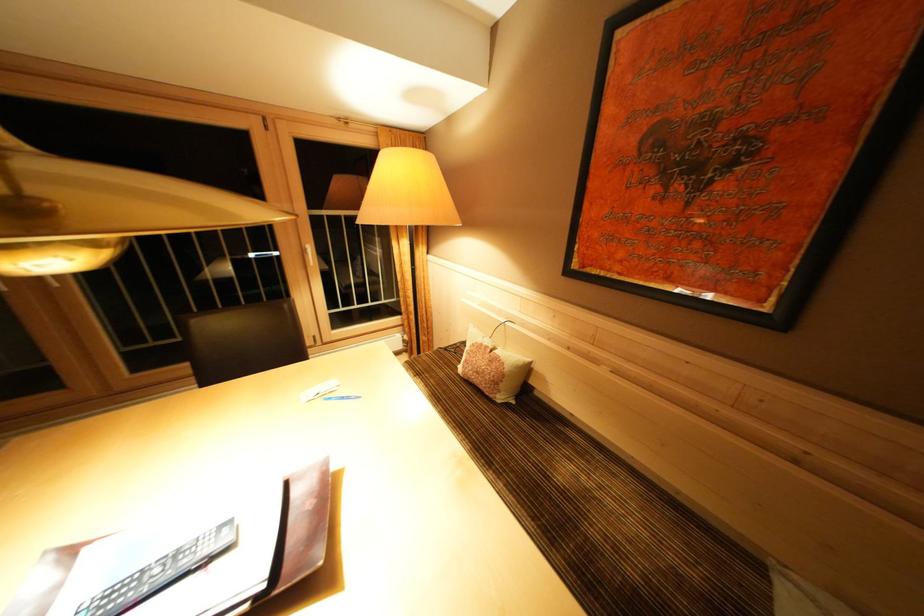
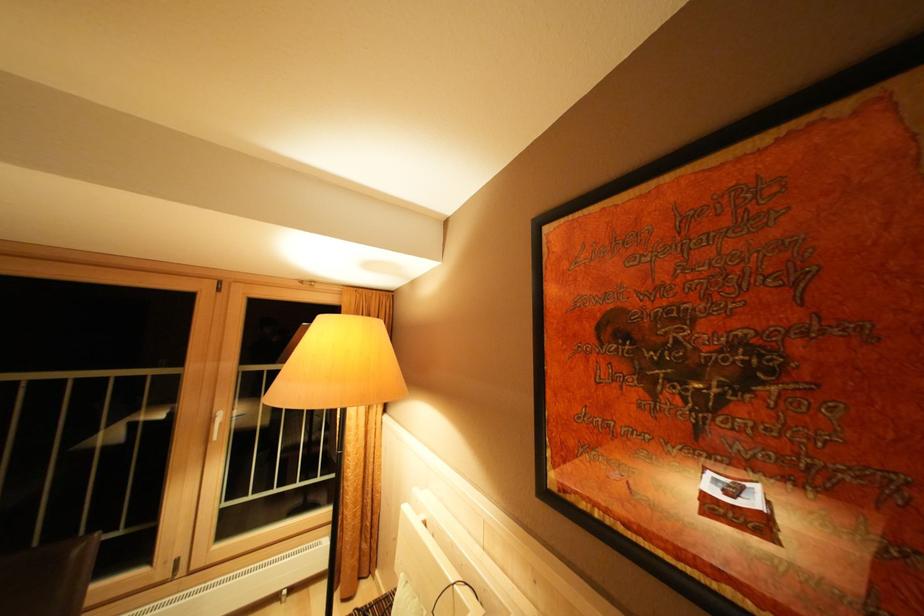
Question: How did the camera likely rotate?

Choices:
 (A) Left
 (B) Right
 (C) Up
 (D) Down

Answer: (C)